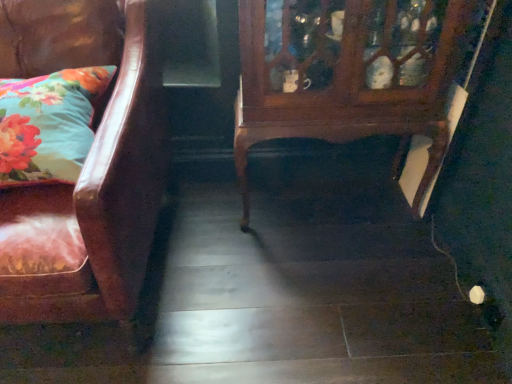
Question: From the image's perspective, is leather couch at left over floral fabric pillow at left?

Choices:
 (A) no
 (B) yes

Answer: (A)

Question: Is leather couch at left positioned behind floral fabric pillow at left?

Choices:
 (A) yes
 (B) no

Answer: (B)

Question: Can you confirm if leather couch at left is wider than floral fabric pillow at left?

Choices:
 (A) no
 (B) yes

Answer: (B)

Question: Is leather couch at left directly adjacent to floral fabric pillow at left?

Choices:
 (A) no
 (B) yes

Answer: (A)

Question: Would you say leather couch at left is outside floral fabric pillow at left?

Choices:
 (A) no
 (B) yes

Answer: (B)

Question: From a real-world perspective, is leather couch at left under floral fabric pillow at left?

Choices:
 (A) no
 (B) yes

Answer: (B)

Question: From a real-world perspective, is wooden cabinet at center positioned over leather couch at left based on gravity?

Choices:
 (A) no
 (B) yes

Answer: (A)

Question: Would you say wooden cabinet at center is a long distance from leather couch at left?

Choices:
 (A) yes
 (B) no

Answer: (B)

Question: Is wooden cabinet at center positioned before leather couch at left?

Choices:
 (A) no
 (B) yes

Answer: (A)

Question: Considering the relative positions of wooden cabinet at center and leather couch at left in the image provided, is wooden cabinet at center to the right of leather couch at left from the viewer's perspective?

Choices:
 (A) no
 (B) yes

Answer: (B)

Question: Does wooden cabinet at center have a greater height compared to leather couch at left?

Choices:
 (A) no
 (B) yes

Answer: (A)

Question: From the image's perspective, is wooden cabinet at center located beneath leather couch at left?

Choices:
 (A) yes
 (B) no

Answer: (B)

Question: Is leather couch at left closer to the viewer compared to wooden cabinet at center?

Choices:
 (A) no
 (B) yes

Answer: (B)